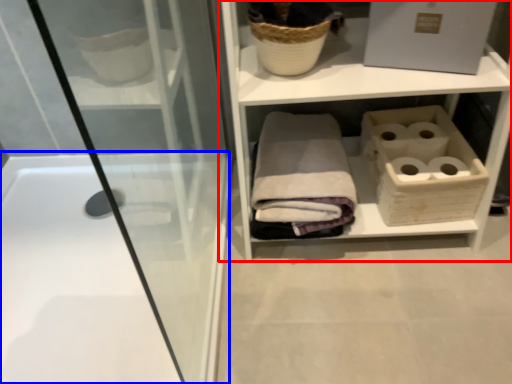
Question: Which object appears closest to the camera in this image, shelf (highlighted by a red box) or bathtub (highlighted by a blue box)?

Choices:
 (A) shelf
 (B) bathtub

Answer: (A)